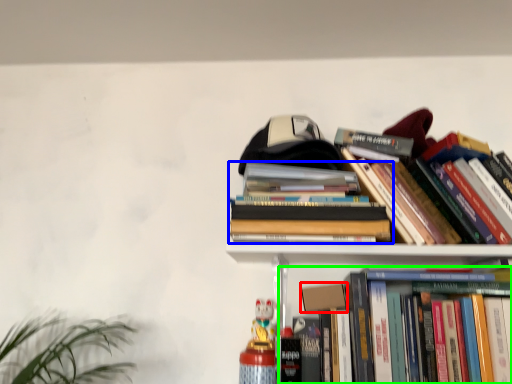
Question: Considering the real-world distances, which object is closest to paperback book (highlighted by a red box)? book (highlighted by a blue box) or book (highlighted by a green box).

Choices:
 (A) book
 (B) book

Answer: (B)